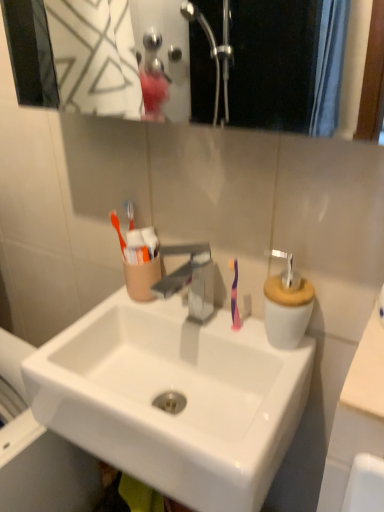
Where is `vacant space situated on the left part of white ceramic soap dispenser at right`? The width and height of the screenshot is (384, 512). vacant space situated on the left part of white ceramic soap dispenser at right is located at coordinates (207, 342).